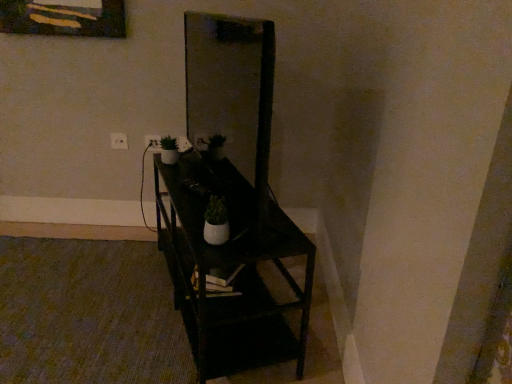
Where is `vacant space in matte glass mirror at center (from a real-world perspective)`? The image size is (512, 384). vacant space in matte glass mirror at center (from a real-world perspective) is located at coordinates (208, 181).